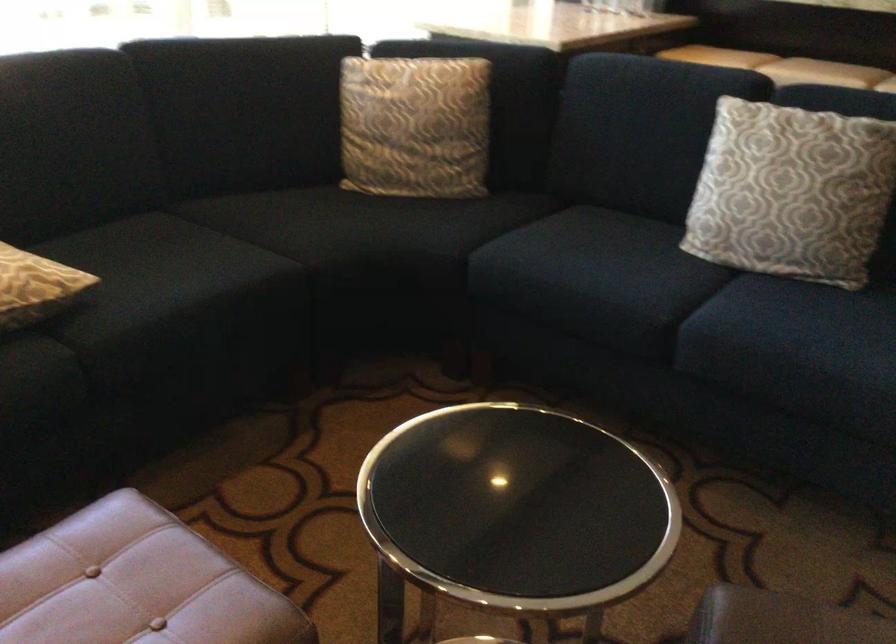
What do you see at coordinates (517, 507) in the screenshot? The image size is (896, 644). I see `the chair sitting surface` at bounding box center [517, 507].